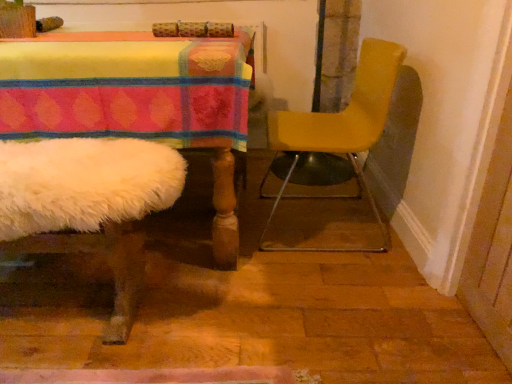
Image resolution: width=512 pixels, height=384 pixels. I want to click on vacant space underneath yellow leather chair at right (from a real-world perspective), so click(x=308, y=221).